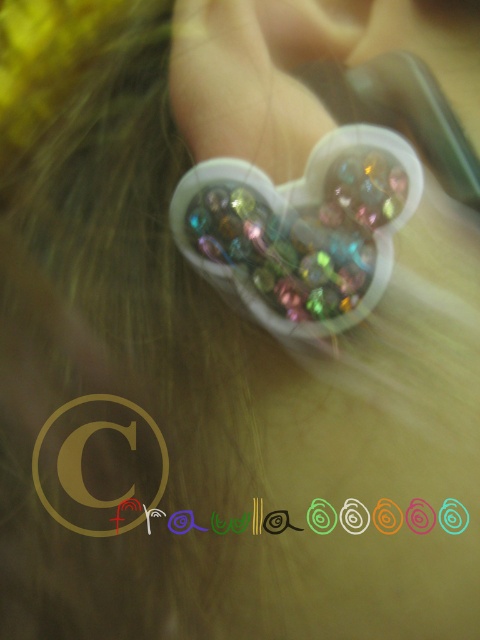
Question: Observing the image, what is the correct spatial positioning of shiny plastic heart at center in reference to pearlized plastic heart at upper center?

Choices:
 (A) below
 (B) above

Answer: (B)

Question: Can you confirm if shiny plastic heart at center is positioned to the right of pearlized plastic heart at upper center?

Choices:
 (A) yes
 (B) no

Answer: (A)

Question: Does shiny plastic heart at center come in front of pearlized plastic heart at upper center?

Choices:
 (A) yes
 (B) no

Answer: (A)

Question: Which point appears farthest from the camera in this image?

Choices:
 (A) (36, 451)
 (B) (363, 214)

Answer: (A)